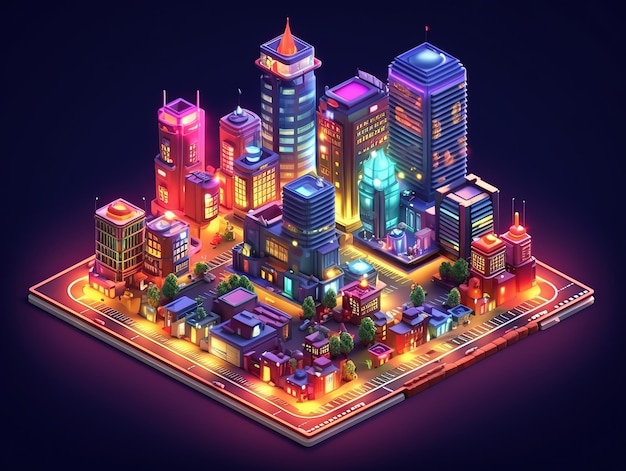
This screenshot has height=471, width=626. In order to click on electronic display in this screenshot , I will do click(404, 124).